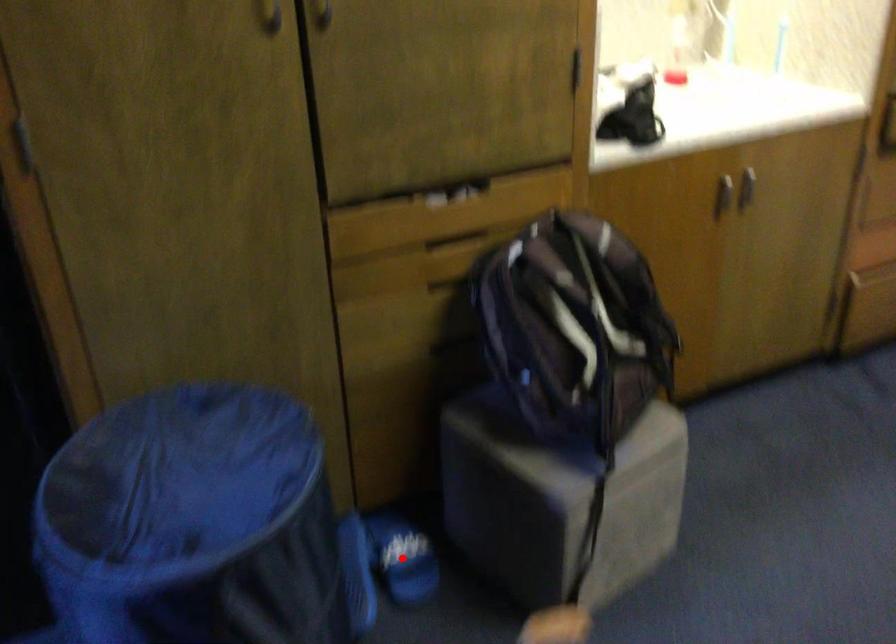
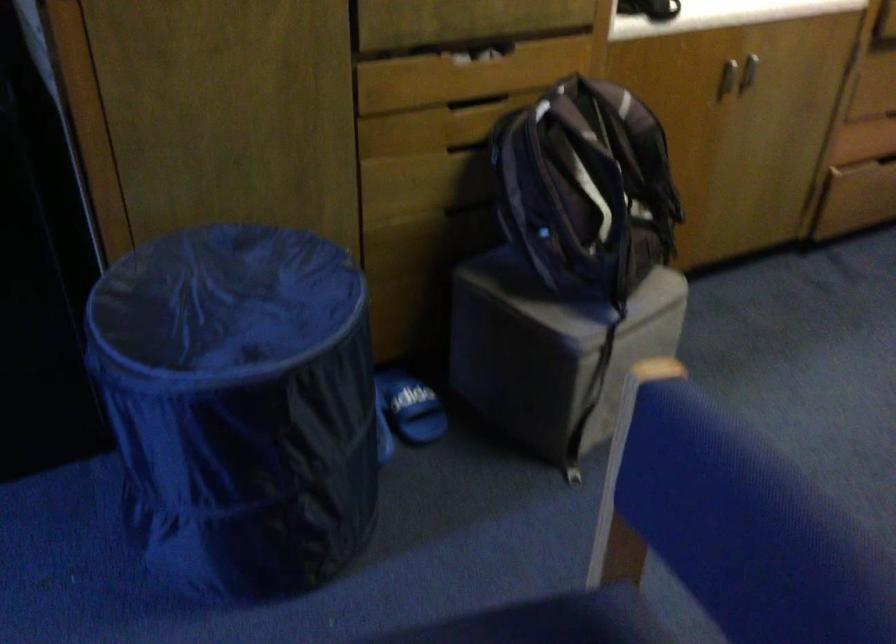
Where in the second image is the point corresponding to the highlighted location from the first image?

(410, 406)